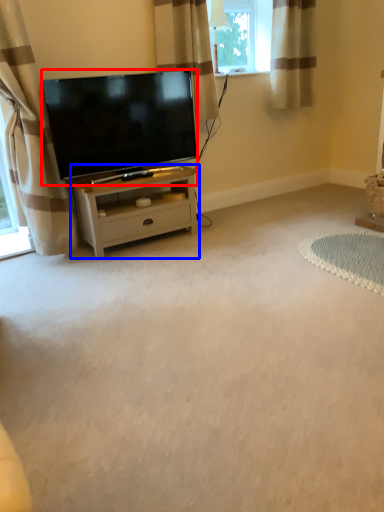
Question: Which of the following is the farthest to the observer, television (highlighted by a red box) or nightstand (highlighted by a blue box)?

Choices:
 (A) television
 (B) nightstand

Answer: (B)